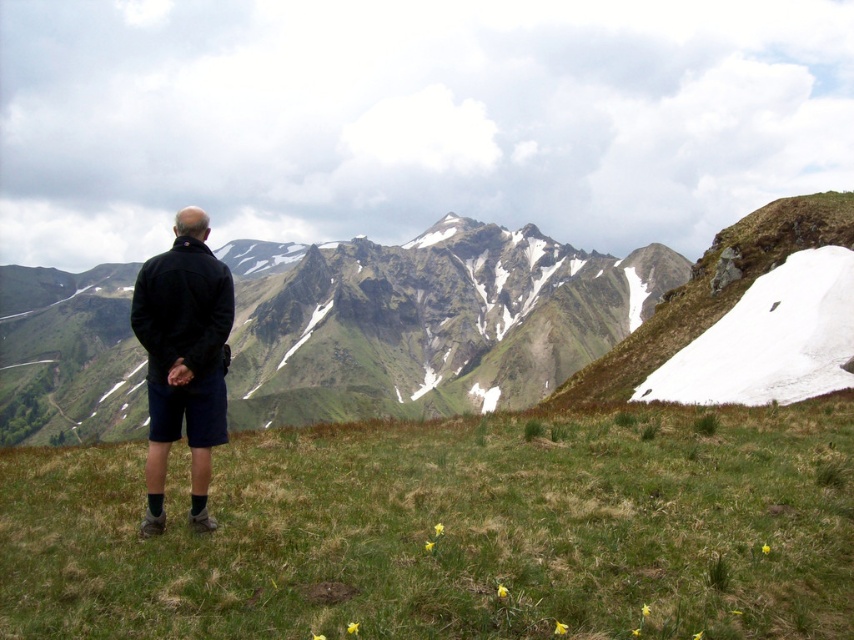
Can you confirm if green grassy at center is shorter than black matte jacket at center?

Yes.

Does green grassy at center have a smaller size compared to black matte jacket at center?

Incorrect, green grassy at center is not smaller in size than black matte jacket at center.

In order to click on green grassy at center in this screenshot , I will do `click(451, 531)`.

Where is `green grassy at center`? The width and height of the screenshot is (854, 640). green grassy at center is located at coordinates (451, 531).

Which is more to the right, green grassy at center or green grassy mountain at center?

From the viewer's perspective, green grassy at center appears more on the right side.

In the scene shown: Is green grassy at center to the right of green grassy mountain at center from the viewer's perspective?

Correct, you'll find green grassy at center to the right of green grassy mountain at center.

Which is behind, point (492, 609) or point (303, 307)?

Point (303, 307)

The image size is (854, 640). In order to click on green grassy at center in this screenshot , I will do `click(451, 531)`.

Which of these two, green grassy mountain at center or black matte jacket at center, stands shorter?

Standing shorter between the two is black matte jacket at center.

Which is in front, point (676, 344) or point (202, 403)?

Positioned in front is point (202, 403).

Describe the element at coordinates (484, 316) in the screenshot. The width and height of the screenshot is (854, 640). I see `green grassy mountain at center` at that location.

Where is `green grassy mountain at center`? The height and width of the screenshot is (640, 854). green grassy mountain at center is located at coordinates (484, 316).